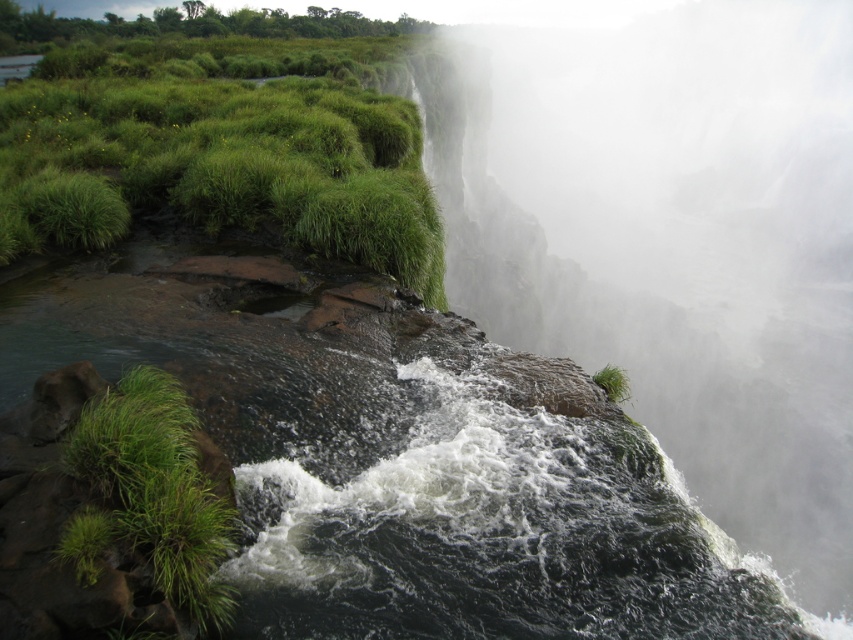
You are a botanist studying the vegetation in this waterfall area. You observe two green grassy areas in the scene. Which one has a wider spread, the green grassy at upper left or the green grassy tuft at lower left?

The green grassy at upper left has a wider spread than the green grassy tuft at lower left.

Based on the photo, you are a hiker trying to navigate through the area near the waterfall. You see two green grassy areas, the green grassy at upper left and the green grassy tuft at lower left. Which one would you choose to step on if you want to avoid sinking into soft ground?

The green grassy at upper left has a larger size compared to the green grassy tuft at lower left, so stepping on the larger one might provide more stability and reduce the chance of sinking into soft ground.